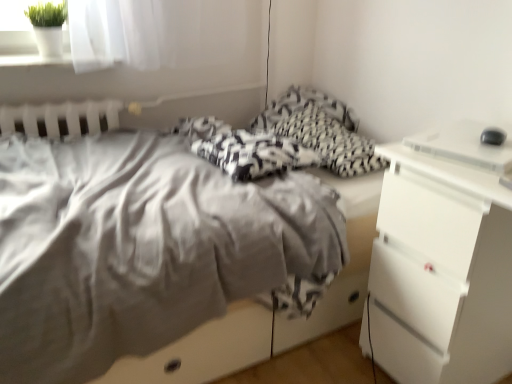
Question: Is white plastic desktop at right to the left of matte gray bed at center from the viewer's perspective?

Choices:
 (A) no
 (B) yes

Answer: (A)

Question: Does white plastic desktop at right come in front of matte gray bed at center?

Choices:
 (A) no
 (B) yes

Answer: (A)

Question: Is white plastic desktop at right shorter than matte gray bed at center?

Choices:
 (A) no
 (B) yes

Answer: (B)

Question: Considering the relative sizes of white plastic desktop at right and matte gray bed at center in the image provided, is white plastic desktop at right bigger than matte gray bed at center?

Choices:
 (A) yes
 (B) no

Answer: (B)

Question: From a real-world perspective, is white plastic desktop at right over matte gray bed at center?

Choices:
 (A) no
 (B) yes

Answer: (B)

Question: Is white plastic desktop at right taller than matte gray bed at center?

Choices:
 (A) yes
 (B) no

Answer: (B)

Question: Is white plastic chest of drawers at right facing away from matte gray bed at center?

Choices:
 (A) no
 (B) yes

Answer: (A)

Question: From a real-world perspective, is white plastic chest of drawers at right over matte gray bed at center?

Choices:
 (A) no
 (B) yes

Answer: (A)

Question: Is white plastic chest of drawers at right in front of matte gray bed at center?

Choices:
 (A) no
 (B) yes

Answer: (A)

Question: Is white plastic chest of drawers at right to the left of matte gray bed at center from the viewer's perspective?

Choices:
 (A) no
 (B) yes

Answer: (A)

Question: From a real-world perspective, does white plastic chest of drawers at right sit lower than matte gray bed at center?

Choices:
 (A) yes
 (B) no

Answer: (A)

Question: Can you confirm if white plastic chest of drawers at right is wider than matte gray bed at center?

Choices:
 (A) no
 (B) yes

Answer: (A)

Question: Is white plastic desktop at right at the right side of white plastic chest of drawers at right?

Choices:
 (A) no
 (B) yes

Answer: (A)